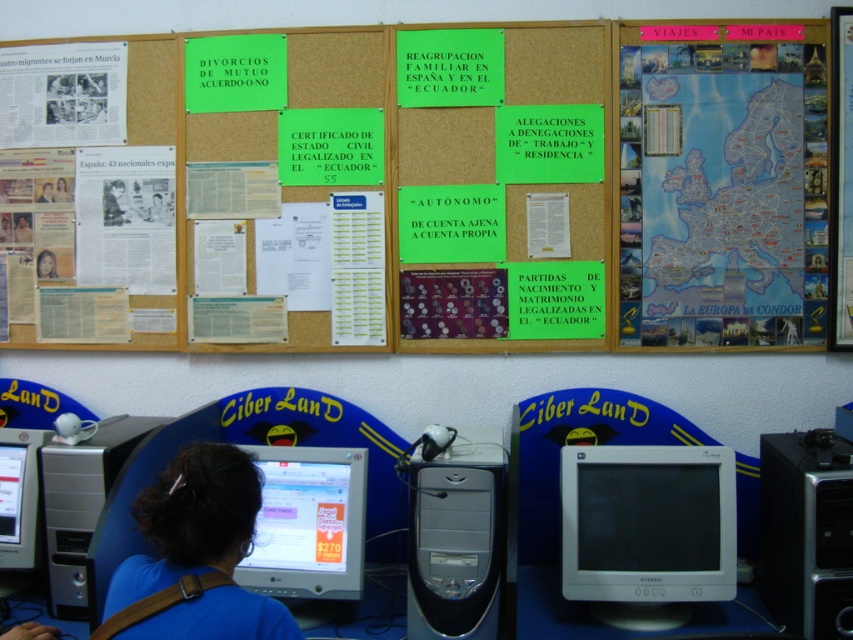
You are setting up a new monitor stand and need to know which device requires more horizontal space. Based on the scene, which object has a greater width between the satin silver desktop at center and the matte black laptop at left?

The satin silver desktop at center has a greater width than the matte black laptop at left.